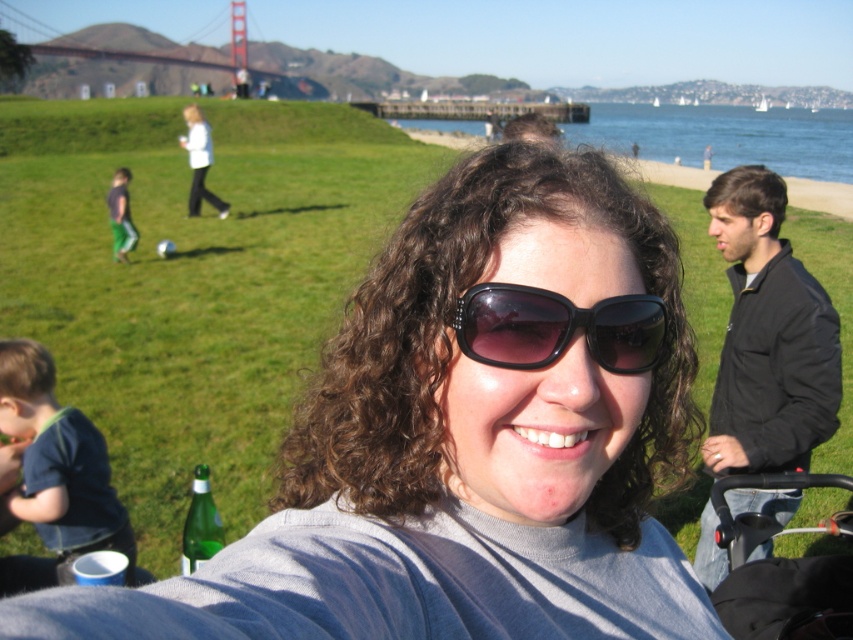
Question: Is black plastic baby carriage at lower right to the left of metallic bridge at upper center from the viewer's perspective?

Choices:
 (A) no
 (B) yes

Answer: (A)

Question: Estimate the real-world distances between objects in this image. Which object is farther from the dark gray pants at left?

Choices:
 (A) metallic bridge at upper center
 (B) black matte sunglasses at center
 (C) black matte jacket at right
 (D) black plastic baby carriage at lower right

Answer: (A)

Question: Considering the real-world distances, which object is closest to the light blue jacket at upper left?

Choices:
 (A) black matte sunglasses at center
 (B) black plastic baby carriage at lower right
 (C) blue water at upper right
 (D) dark gray pants at left

Answer: (D)

Question: Among these objects, which one is nearest to the camera?

Choices:
 (A) metallic bridge at upper center
 (B) black plastic baby carriage at lower right
 (C) light blue jacket at upper left
 (D) blue water at upper right

Answer: (B)

Question: Does black matte jacket at right appear over dark gray pants at left?

Choices:
 (A) no
 (B) yes

Answer: (A)

Question: Does black matte jacket at right have a lesser width compared to light blue jacket at upper left?

Choices:
 (A) yes
 (B) no

Answer: (A)